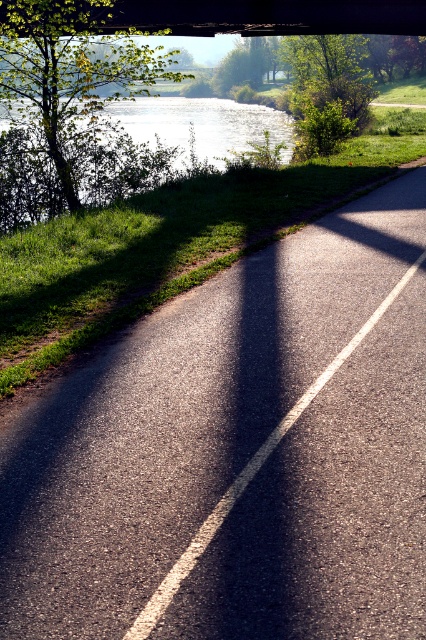
Does point (26, 212) come in front of point (239, 16)?

Yes, it is in front of point (239, 16).

Can you confirm if glistening water at upper left is positioned to the left of concrete bridge at upper center?

Indeed, glistening water at upper left is positioned on the left side of concrete bridge at upper center.

You are a GUI agent. You are given a task and a screenshot of the screen. Output one action in this format:
    pyautogui.click(x=<x>, y=<y>)
    Task: Click on the glistening water at upper left
    
    Given the screenshot: What is the action you would take?
    pyautogui.click(x=164, y=141)

Which of these two, asphalt at center or concrete bridge at upper center, stands shorter?

asphalt at center is shorter.

Does point (209, 440) lie behind point (385, 20)?

No, (209, 440) is in front of (385, 20).

Does point (94, 404) lie behind point (293, 13)?

That is False.

I want to click on asphalt at center, so [181, 417].

Between asphalt at center and glistening water at upper left, which one appears on the left side from the viewer's perspective?

glistening water at upper left is more to the left.

Can you confirm if asphalt at center is bigger than glistening water at upper left?

Actually, asphalt at center might be smaller than glistening water at upper left.

The image size is (426, 640). What do you see at coordinates (181, 417) in the screenshot? I see `asphalt at center` at bounding box center [181, 417].

The width and height of the screenshot is (426, 640). What are the coordinates of `asphalt at center` in the screenshot? It's located at (181, 417).